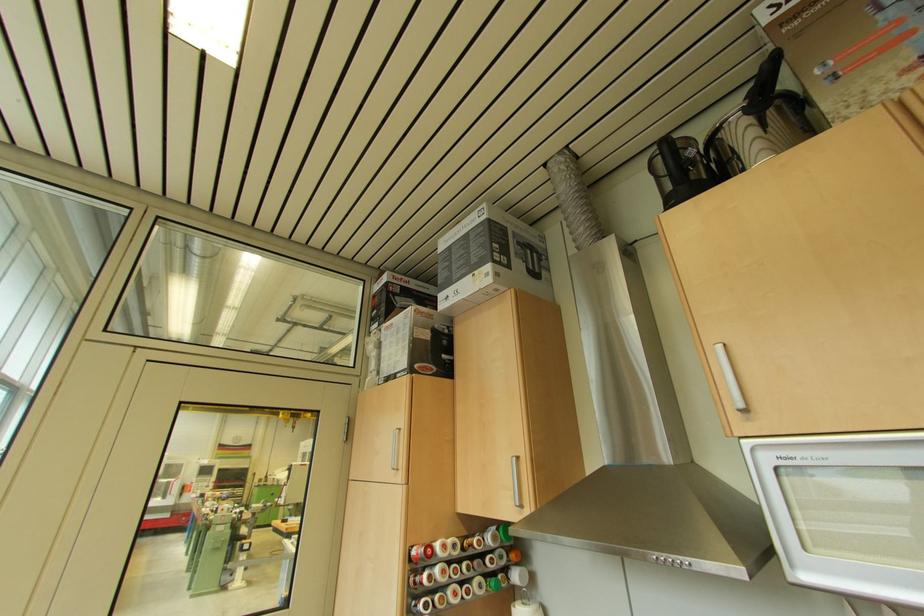
What are the coordinates of `white cabinet handle` in the screenshot? It's located at (513, 408).